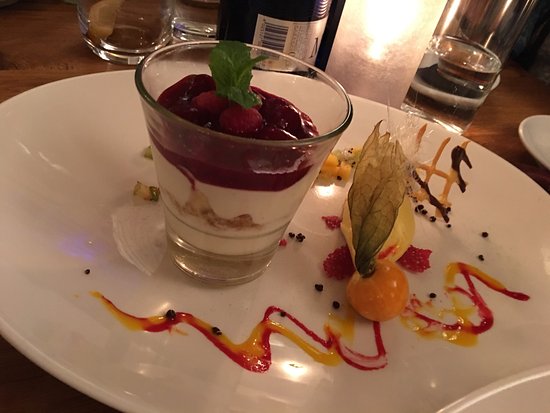
You are a GUI agent. You are given a task and a screenshot of the screen. Output one action in this format:
    pyautogui.click(x=<x>, y=<y>)
    Task: Click on the table
    This screenshot has width=550, height=413.
    Given the screenshot: What is the action you would take?
    pyautogui.click(x=489, y=117)